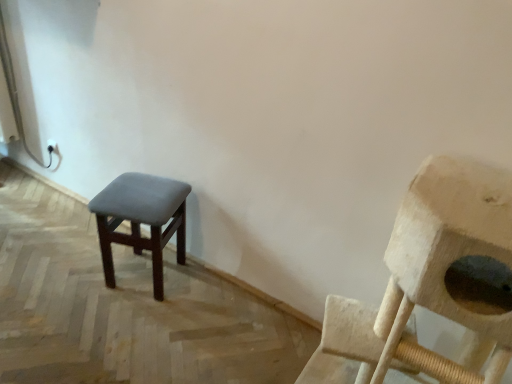
Question: Is wooden cat tree at right in front of or behind dark gray fabric stool at left in the image?

Choices:
 (A) behind
 (B) front

Answer: (B)

Question: Considering the positions of point (428, 360) and point (104, 198), is point (428, 360) closer or farther from the camera than point (104, 198)?

Choices:
 (A) closer
 (B) farther

Answer: (A)

Question: Considering the positions of wooden cat tree at right and dark gray fabric stool at left in the image, is wooden cat tree at right taller or shorter than dark gray fabric stool at left?

Choices:
 (A) short
 (B) tall

Answer: (B)

Question: Is dark gray fabric stool at left in front of or behind wooden cat tree at right in the image?

Choices:
 (A) front
 (B) behind

Answer: (B)

Question: Do you think dark gray fabric stool at left is within wooden cat tree at right, or outside of it?

Choices:
 (A) inside
 (B) outside

Answer: (B)

Question: From the image's perspective, is dark gray fabric stool at left located above or below wooden cat tree at right?

Choices:
 (A) below
 (B) above

Answer: (B)

Question: Is dark gray fabric stool at left taller or shorter than wooden cat tree at right?

Choices:
 (A) tall
 (B) short

Answer: (B)